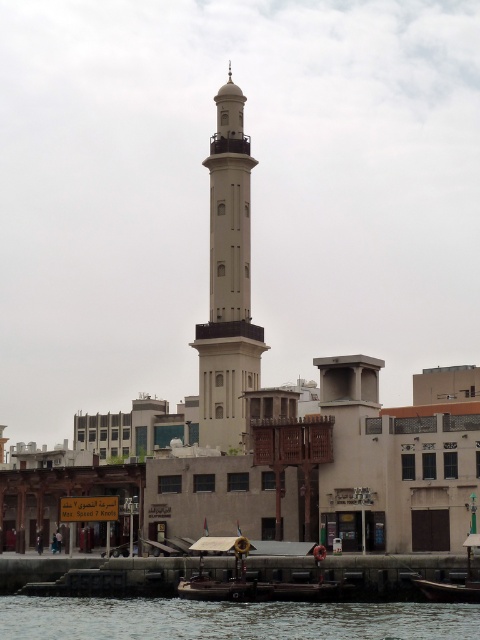
Which is more to the left, dark blue water at lower center or white smooth minaret at center?

Positioned to the left is dark blue water at lower center.

Can you confirm if dark blue water at lower center is smaller than white smooth minaret at center?

Yes.

Where is `dark blue water at lower center`? The width and height of the screenshot is (480, 640). dark blue water at lower center is located at coordinates (229, 620).

Can you confirm if dark blue water at lower center is positioned to the left of wooden boat at lower right?

Yes, dark blue water at lower center is to the left of wooden boat at lower right.

In order to click on dark blue water at lower center in this screenshot , I will do `click(229, 620)`.

Who is lower down, white smooth minaret at center or wooden boat at lower right?

Positioned lower is wooden boat at lower right.

Is white smooth minaret at center thinner than wooden boat at lower right?

No, white smooth minaret at center is not thinner than wooden boat at lower right.

You are a GUI agent. You are given a task and a screenshot of the screen. Output one action in this format:
    pyautogui.click(x=<x>, y=<y>)
    Task: Click on the white smooth minaret at center
    The image size is (480, 640).
    Given the screenshot: What is the action you would take?
    pyautogui.click(x=228, y=284)